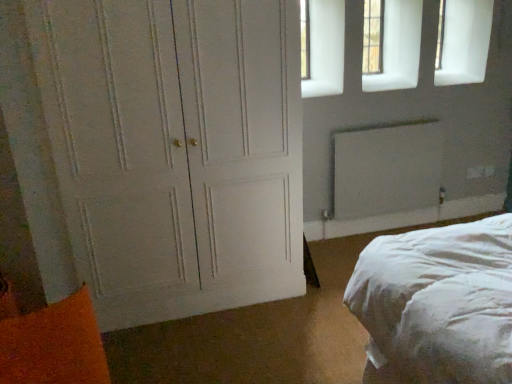
Identify the location of vacant space in front of clear glass window at upper right. (380, 72).